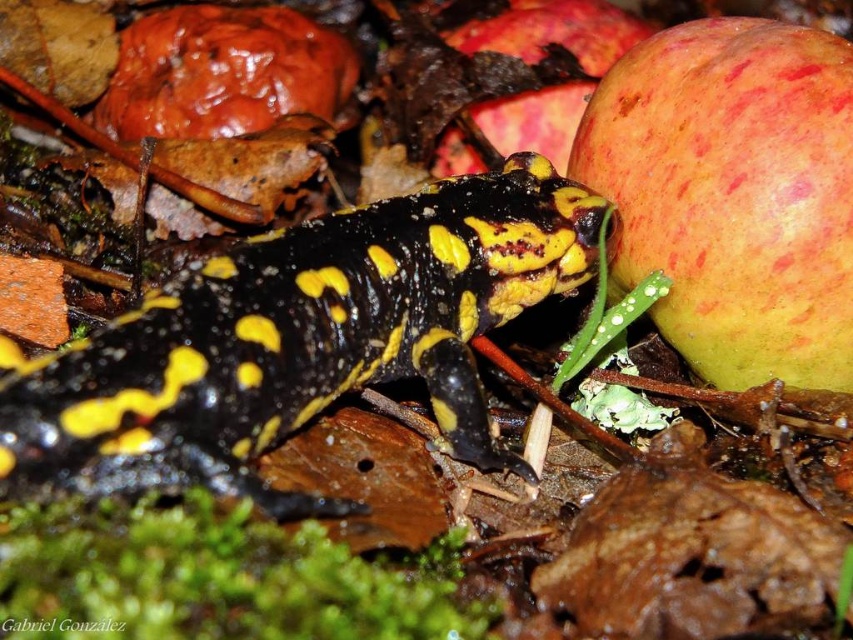
You are a squirrel looking for food in the forest. You see a point marked at coordinates (733, 195) which indicates a speckled red apple at right. Can you determine if the apple is within your reach if you are currently positioned at the fire salamander?

The point marked at coordinates (733, 195) indicates the location of the speckled red apple at right. Since the fire salamander is positioned centrally in the frame with its head turned slightly to the right, the apple is located to the right side of the salamander. Squirrels typically have a reaching range of about 1 meter. Without specific distance data between the salamander and the apple, it is impossible to definitively determine if the apple is within reach. However, based on the spatial arrangement

You are a forager searching for edible fruits in the forest. You spot a speckled red apple at right. Based on its position, can you estimate whether it is located closer to the bottom or the top of the image?

The speckled red apple at right is located at point 0.305 on the horizontal axis and 0.860 on the vertical axis. Since the vertical coordinate 0.860 is closer to 1.0, which typically represents the bottom of the image in coordinate systems, the apple is positioned closer to the bottom of the image.

You are a forager looking for apples in the forest. You spot a speckled red apple at right and a ripe red apple at upper right. Which apple is narrower in width?

The speckled red apple at right is thinner than the ripe red apple at upper right, so the speckled red apple at right is narrower in width.